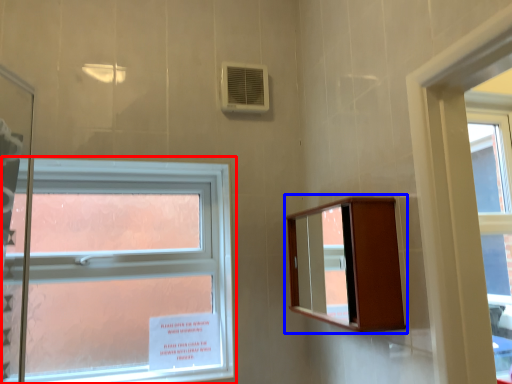
Question: Among these objects, which one is nearest to the camera, window (highlighted by a red box) or medicine cabinet (highlighted by a blue box)?

Choices:
 (A) window
 (B) medicine cabinet

Answer: (B)